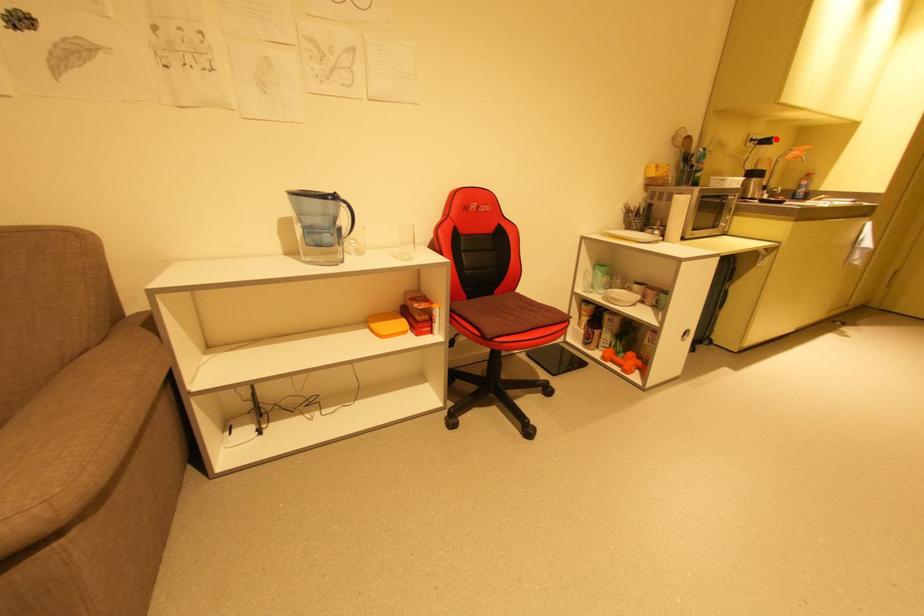
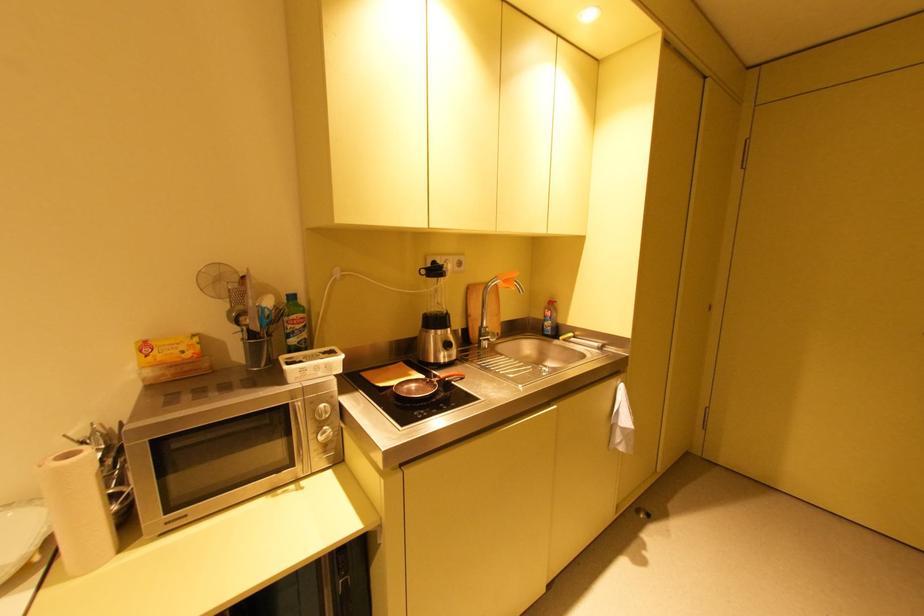
Question: I am providing you with two images of the same scene from different viewpoints. Given a red point in image1, look at the same physical point in image2. Is it:

Choices:
 (A) Closer to the viewpoint
 (B) Farther from the viewpoint

Answer: (A)